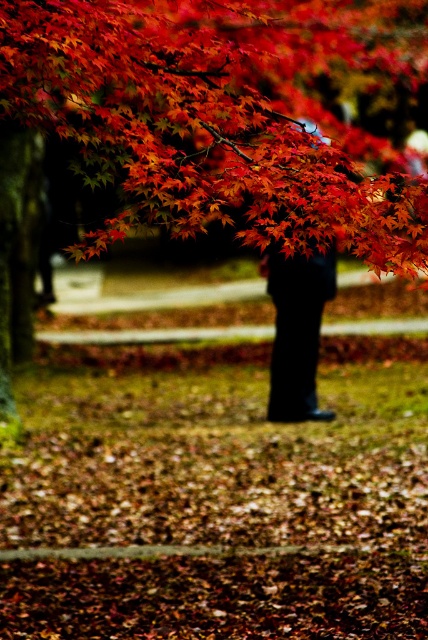
Question: Does shiny red maple leaves at upper center have a smaller size compared to black matte pants at center?

Choices:
 (A) no
 (B) yes

Answer: (B)

Question: Which object is farther from the camera taking this photo?

Choices:
 (A) shiny red maple leaves at upper center
 (B) black matte pants at center

Answer: (B)

Question: Is shiny red maple leaves at upper center closer to camera compared to black matte pants at center?

Choices:
 (A) yes
 (B) no

Answer: (A)

Question: From the image, what is the correct spatial relationship of shiny red maple leaves at upper center in relation to black matte pants at center?

Choices:
 (A) right
 (B) left

Answer: (A)